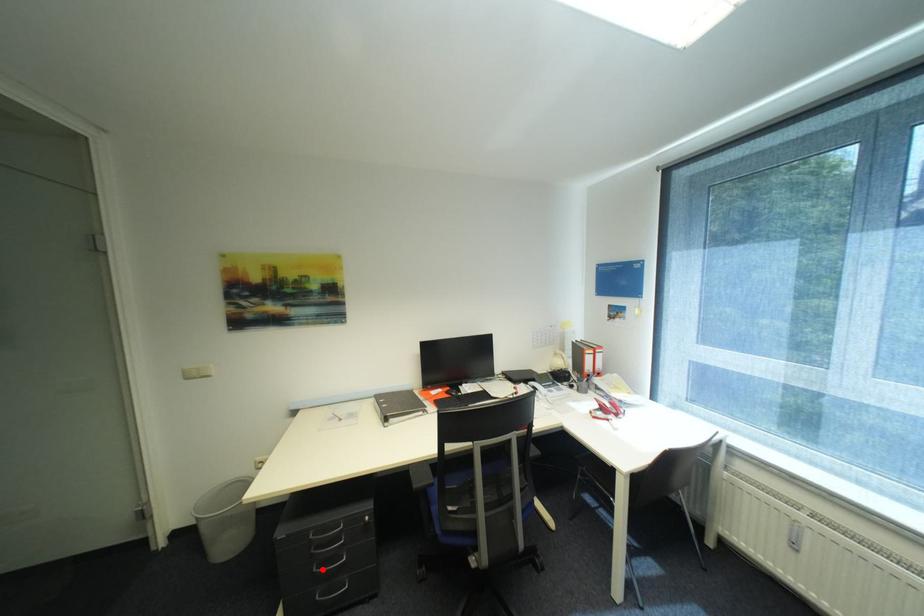
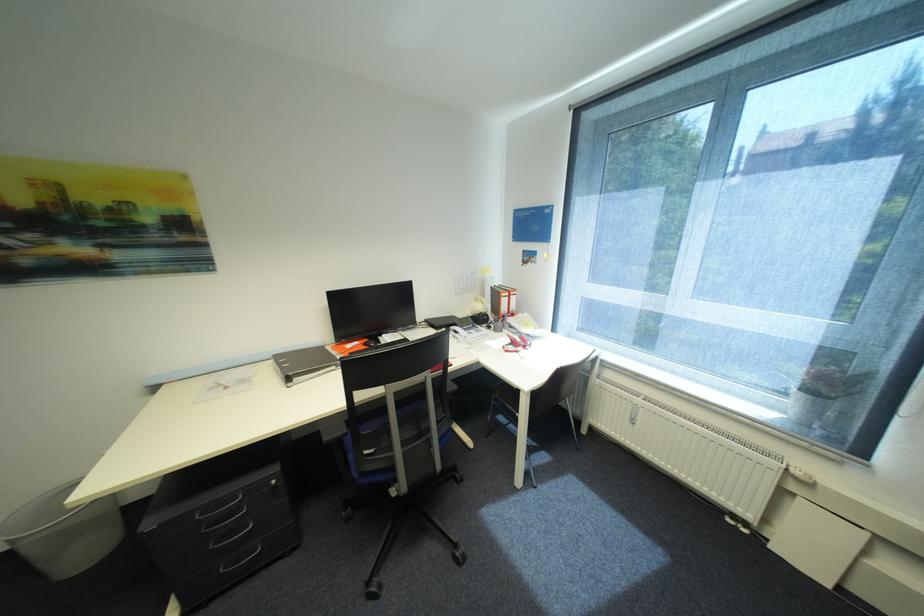
Find the pixel in the second image that matches the highlighted location in the first image.

(219, 546)